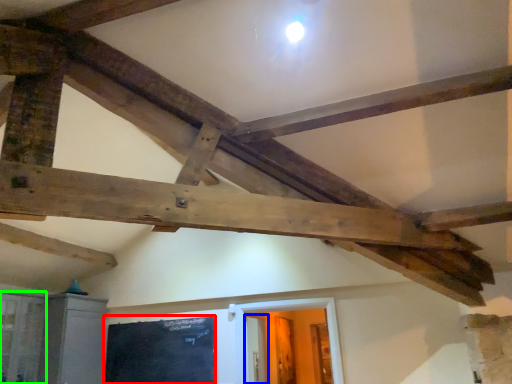
Question: Which object is the farthest from bulletin board (highlighted by a red box)? Choose among these: door (highlighted by a blue box) or window (highlighted by a green box).

Choices:
 (A) door
 (B) window

Answer: (A)